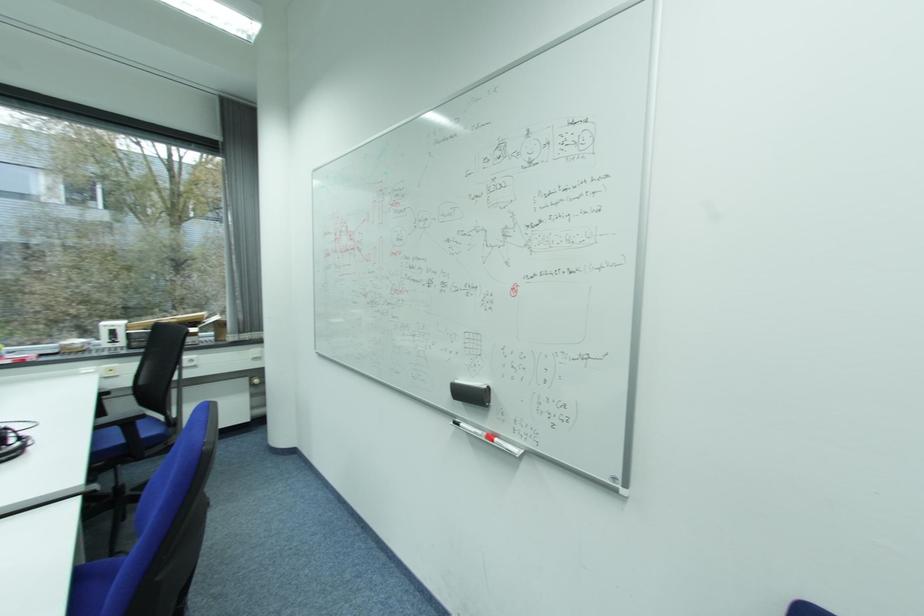
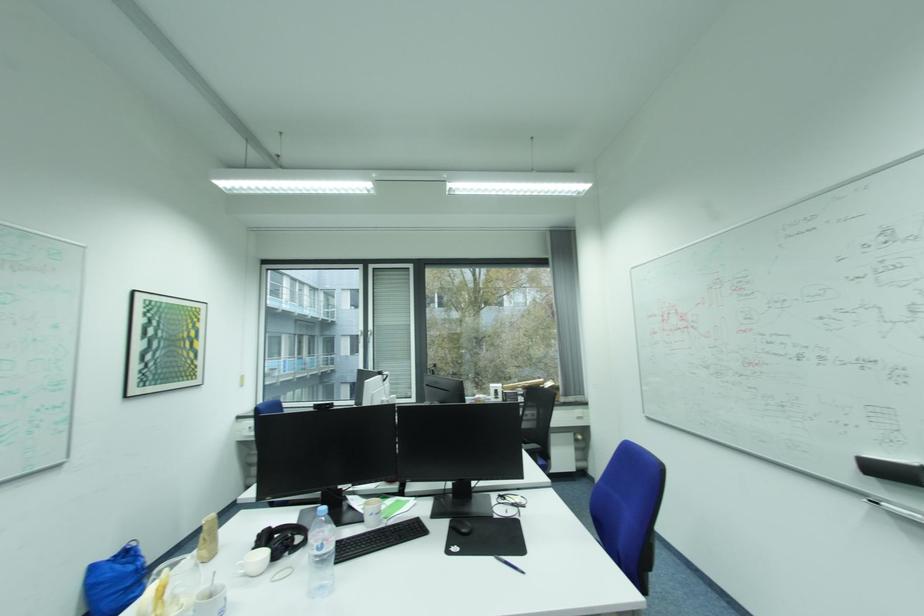
Question: I am providing you with two images of the same scene from different viewpoints. Please identify which objects are invisible in image2.

Choices:
 (A) wall-mounted coat hook
 (B) black chair sitting surface
 (C) white ceramic mug
 (D) black computer mouse

Answer: (B)